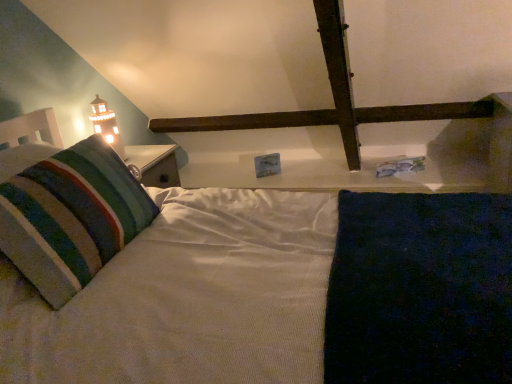
Question: Is soft striped pillow at left directly adjacent to matte white tower at upper left?

Choices:
 (A) no
 (B) yes

Answer: (A)

Question: Does soft striped pillow at left have a lesser height compared to matte white tower at upper left?

Choices:
 (A) yes
 (B) no

Answer: (A)

Question: Considering the relative positions of soft striped pillow at left and matte white tower at upper left in the image provided, is soft striped pillow at left to the left of matte white tower at upper left from the viewer's perspective?

Choices:
 (A) yes
 (B) no

Answer: (A)

Question: Is soft striped pillow at left facing away from matte white tower at upper left?

Choices:
 (A) yes
 (B) no

Answer: (A)

Question: Is soft striped pillow at left behind matte white tower at upper left?

Choices:
 (A) no
 (B) yes

Answer: (A)

Question: Considering the relative sizes of soft striped pillow at left and matte white tower at upper left in the image provided, is soft striped pillow at left smaller than matte white tower at upper left?

Choices:
 (A) yes
 (B) no

Answer: (B)

Question: Is matte white tower at upper left not close to soft striped pillow at left?

Choices:
 (A) no
 (B) yes

Answer: (A)

Question: Is matte white tower at upper left facing towards soft striped pillow at left?

Choices:
 (A) yes
 (B) no

Answer: (B)

Question: From the image's perspective, is matte white tower at upper left below soft striped pillow at left?

Choices:
 (A) no
 (B) yes

Answer: (A)

Question: Considering the relative sizes of matte white tower at upper left and soft striped pillow at left in the image provided, is matte white tower at upper left taller than soft striped pillow at left?

Choices:
 (A) yes
 (B) no

Answer: (A)

Question: Considering the relative sizes of matte white tower at upper left and soft striped pillow at left in the image provided, is matte white tower at upper left thinner than soft striped pillow at left?

Choices:
 (A) yes
 (B) no

Answer: (A)

Question: Is matte white tower at upper left placed right next to soft striped pillow at left?

Choices:
 (A) yes
 (B) no

Answer: (B)

Question: Is matte white tower at upper left bigger or smaller than soft striped pillow at left?

Choices:
 (A) big
 (B) small

Answer: (B)